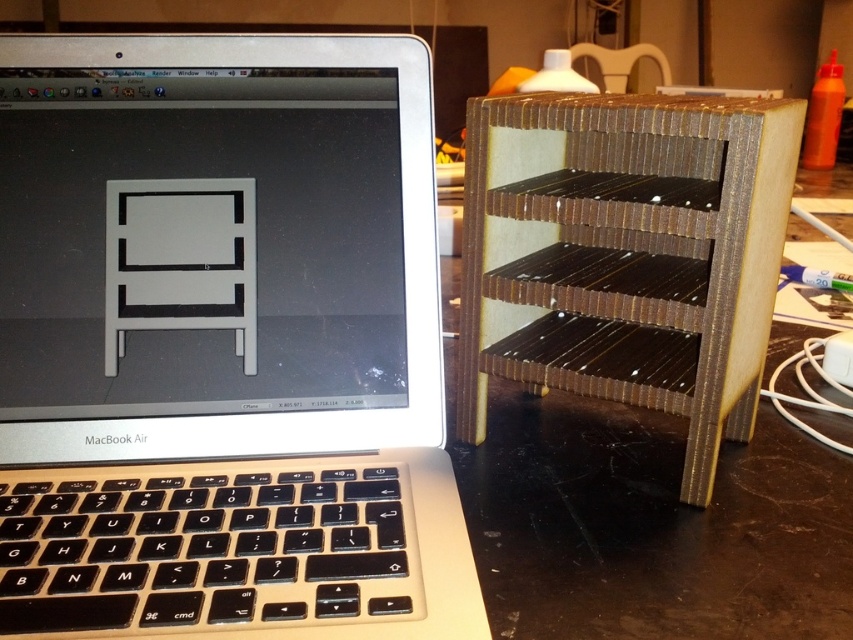
Question: Estimate the real-world distances between objects in this image. Which object is closer to the white matte/transparent object at upper left?

Choices:
 (A) wooden/matte shelf at right
 (B) silver/black plastic laptop at left
 (C) wooden chair at upper center

Answer: (B)

Question: Is the position of silver/black plastic laptop at left more distant than that of wooden chair at upper center?

Choices:
 (A) no
 (B) yes

Answer: (A)

Question: Does silver/black plastic laptop at left have a smaller size compared to wooden/matte shelf at right?

Choices:
 (A) no
 (B) yes

Answer: (B)

Question: Based on their relative distances, which object is nearer to the wooden chair at upper center?

Choices:
 (A) silver/black plastic laptop at left
 (B) wooden/matte shelf at right

Answer: (B)

Question: Is wooden/matte shelf at right smaller than wooden chair at upper center?

Choices:
 (A) yes
 (B) no

Answer: (A)

Question: Which object is the closest to the white matte/transparent object at upper left?

Choices:
 (A) silver/black plastic laptop at left
 (B) wooden/matte shelf at right
 (C) wooden chair at upper center

Answer: (A)